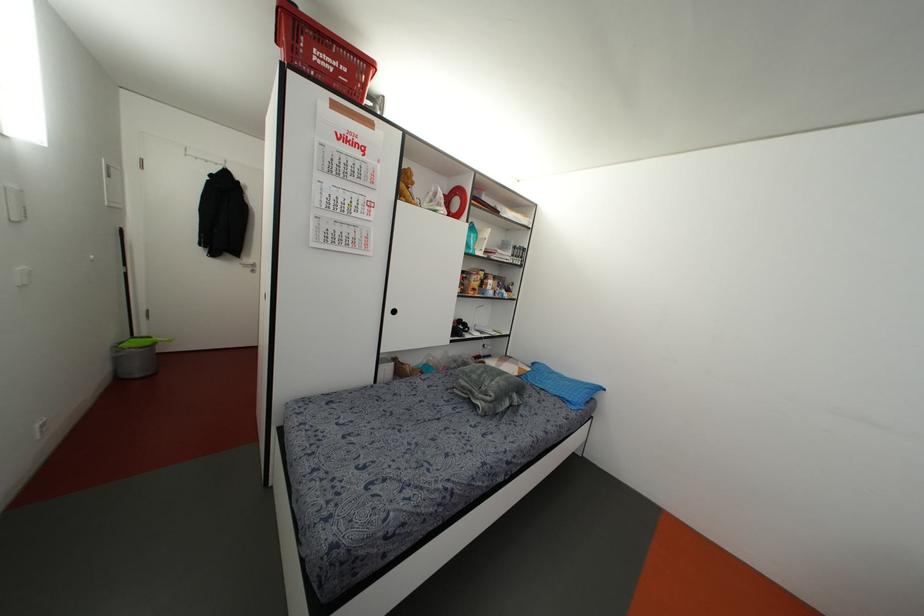
Where is `black cabinet handle`? The width and height of the screenshot is (924, 616). black cabinet handle is located at coordinates (393, 310).